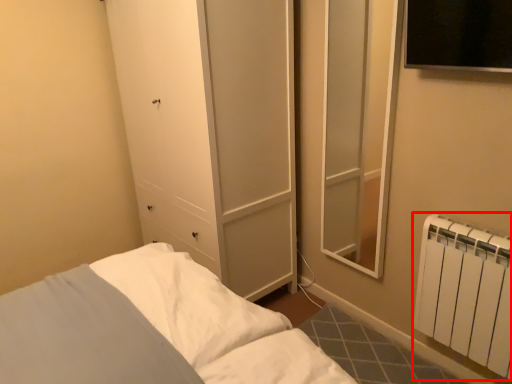
Question: Observing the image, what is the correct spatial positioning of radiator (annotated by the red box) in reference to pillow?

Choices:
 (A) left
 (B) right

Answer: (B)